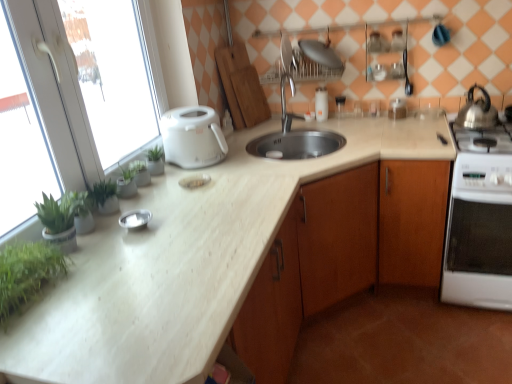
Where is `vacant space behind silver metallic bowl at center, which ranks as the fourth appliance in back-to-front order`? Image resolution: width=512 pixels, height=384 pixels. vacant space behind silver metallic bowl at center, which ranks as the fourth appliance in back-to-front order is located at coordinates [157, 200].